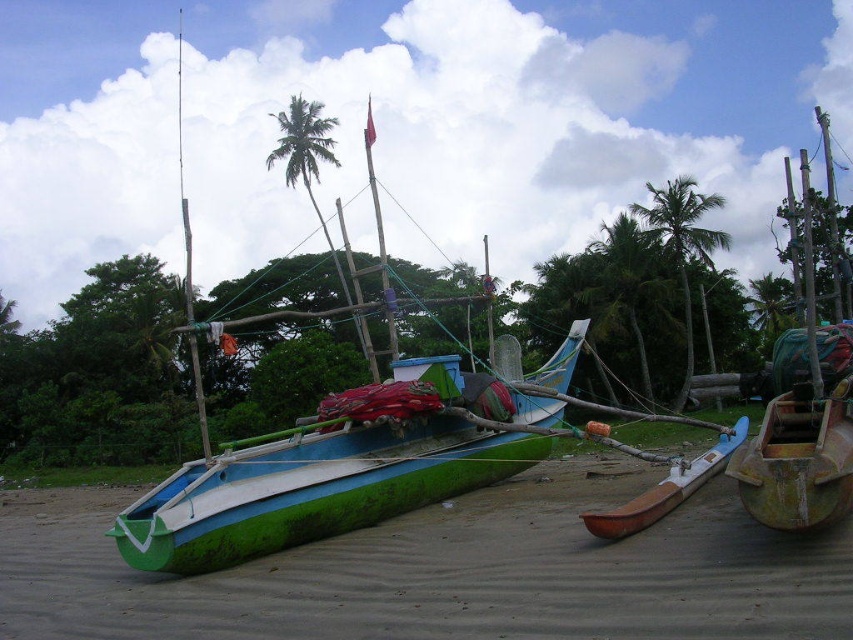
Who is lower down, green wood boat at center or green matte boat at center?

Positioned lower is green wood boat at center.

Who is positioned more to the left, green wood boat at center or green matte boat at center?

green matte boat at center is more to the left.

The width and height of the screenshot is (853, 640). Identify the location of green wood boat at center. (440, 572).

Does green matte boat at center have a lesser height compared to green leafy palm tree at upper center?

Yes, green matte boat at center is shorter than green leafy palm tree at upper center.

Can you confirm if green matte boat at center is thinner than green leafy palm tree at upper center?

Correct, green matte boat at center's width is less than green leafy palm tree at upper center's.

Between point (283, 524) and point (670, 196), which one is positioned behind?

The point (670, 196) is more distant.

At what (x,y) coordinates should I click in order to perform the action: click on green matte boat at center. Please return your answer as a coordinate pair (x, y). Looking at the image, I should click on (312, 486).

Is point (612, 291) farther from viewer compared to point (693, 465)?

Yes, point (612, 291) is farther from viewer.

Who is shorter, green leafy palm tree at center or brown wood canoe at lower right?

brown wood canoe at lower right

Find the location of `green leafy palm tree at center`. green leafy palm tree at center is located at coordinates [631, 298].

The height and width of the screenshot is (640, 853). I want to click on green leafy palm tree at center, so click(631, 298).